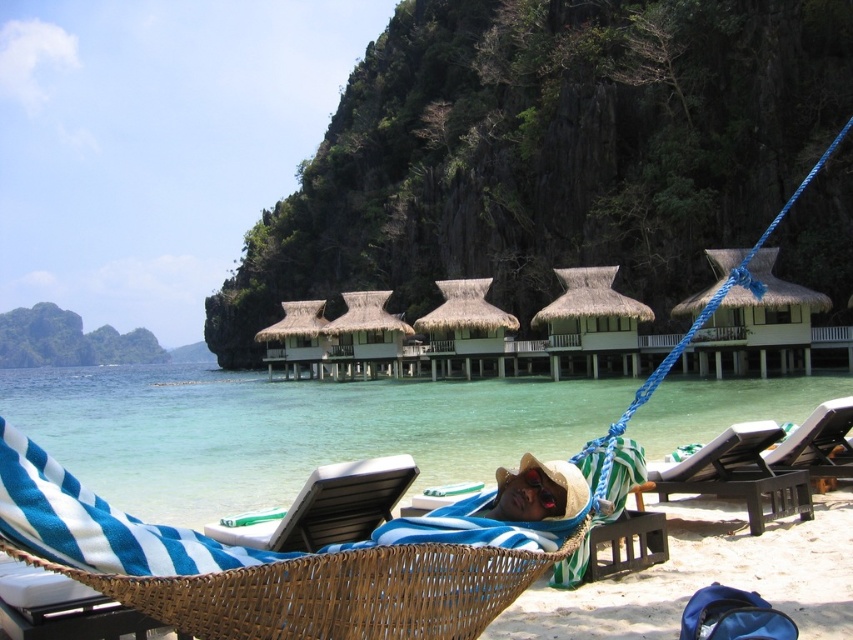
Question: Is the position of blue striped fabric at center less distant than that of beige straw hat at center?

Choices:
 (A) yes
 (B) no

Answer: (A)

Question: Based on their relative distances, which object is nearer to the thatched roof huts at center?

Choices:
 (A) blue striped beach chair at center
 (B) black plastic beach chair at lower center

Answer: (A)

Question: Is black plastic beach chair at center positioned in front of white thatch hut at center?

Choices:
 (A) yes
 (B) no

Answer: (A)

Question: Which point is farther from the camera taking this photo?

Choices:
 (A) (305, 337)
 (B) (592, 460)
 (C) (338, 570)
 (D) (660, 531)

Answer: (A)

Question: Does black plastic beach chair at center have a smaller size compared to thatched straw hut at center?

Choices:
 (A) yes
 (B) no

Answer: (A)

Question: Which point appears farthest from the camera in this image?

Choices:
 (A) (581, 486)
 (B) (276, 596)

Answer: (A)